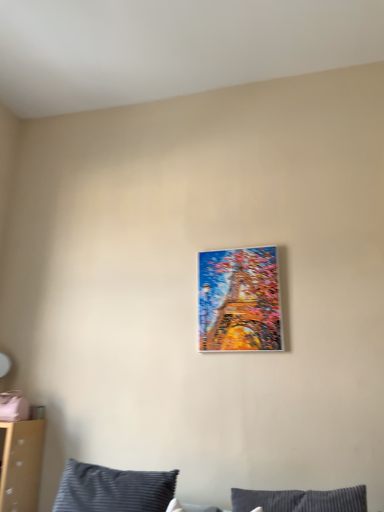
Question: Is metallic gold painting at center positioned with its back to dark blue striped pillow at lower center?

Choices:
 (A) yes
 (B) no

Answer: (B)

Question: Is the depth of metallic gold painting at center less than that of dark blue striped pillow at lower center?

Choices:
 (A) no
 (B) yes

Answer: (A)

Question: Can you confirm if metallic gold painting at center is bigger than dark blue striped pillow at lower center?

Choices:
 (A) no
 (B) yes

Answer: (A)

Question: Are metallic gold painting at center and dark blue striped pillow at lower center making contact?

Choices:
 (A) yes
 (B) no

Answer: (B)

Question: Is metallic gold painting at center at the left side of dark blue striped pillow at lower center?

Choices:
 (A) no
 (B) yes

Answer: (A)

Question: Is metallic gold painting at center positioned far away from dark blue striped pillow at lower center?

Choices:
 (A) no
 (B) yes

Answer: (A)

Question: Does dark blue striped pillow at lower center have a lesser width compared to metallic gold painting at center?

Choices:
 (A) yes
 (B) no

Answer: (B)

Question: From the image's perspective, is dark blue striped pillow at lower center under metallic gold painting at center?

Choices:
 (A) yes
 (B) no

Answer: (A)

Question: Could you tell me if dark blue striped pillow at lower center is turned towards metallic gold painting at center?

Choices:
 (A) yes
 (B) no

Answer: (B)

Question: Does dark blue striped pillow at lower center come behind metallic gold painting at center?

Choices:
 (A) no
 (B) yes

Answer: (A)

Question: Is dark blue striped pillow at lower center shorter than metallic gold painting at center?

Choices:
 (A) no
 (B) yes

Answer: (B)

Question: From a real-world perspective, is dark blue striped pillow at lower center under metallic gold painting at center?

Choices:
 (A) no
 (B) yes

Answer: (B)

Question: Considering the relative positions of metallic gold painting at center and dark blue striped pillow at lower center in the image provided, is metallic gold painting at center to the left or to the right of dark blue striped pillow at lower center?

Choices:
 (A) right
 (B) left

Answer: (A)